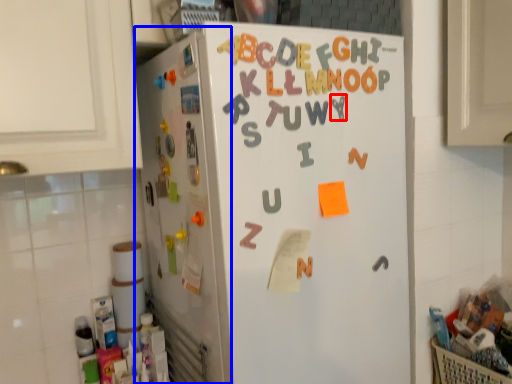
Question: Which object appears farthest to the camera in this image, letter (highlighted by a red box) or appliance (highlighted by a blue box)?

Choices:
 (A) letter
 (B) appliance

Answer: (A)